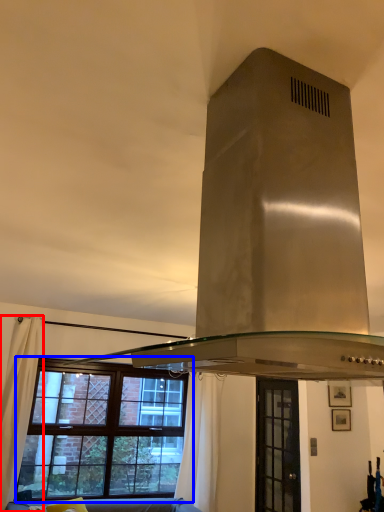
Question: Which object appears farthest to the camera in this image, curtain (highlighted by a red box) or window (highlighted by a blue box)?

Choices:
 (A) curtain
 (B) window

Answer: (B)